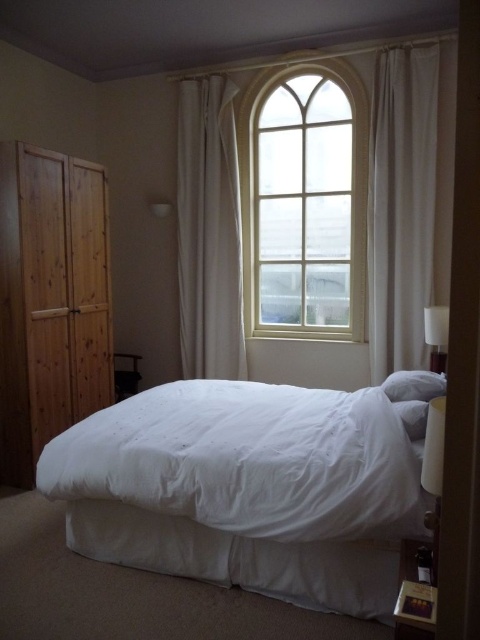
Does white sheer curtain at right have a greater width compared to white soft pillow at right?

Indeed, white sheer curtain at right has a greater width compared to white soft pillow at right.

Can you confirm if white sheer curtain at right is taller than white soft pillow at right?

Yes.

Is point (415, 81) positioned after point (412, 400)?

Yes, it is behind point (412, 400).

Where is `white sheer curtain at right`? white sheer curtain at right is located at coordinates (400, 205).

Is point (350, 211) less distant than point (227, 243)?

Yes.

Who is positioned more to the left, white wooden window at center or white fabric curtain at upper center?

Positioned to the left is white fabric curtain at upper center.

Identify the location of white wooden window at center. (304, 193).

Does white soft bed at center come in front of white soft pillow at right?

That is True.

Who is positioned more to the left, white soft bed at center or white soft pillow at right?

Positioned to the left is white soft bed at center.

The width and height of the screenshot is (480, 640). In order to click on white soft bed at center in this screenshot , I will do (x=249, y=488).

Locate an element on the screen. Image resolution: width=480 pixels, height=640 pixels. white soft bed at center is located at coordinates (249, 488).